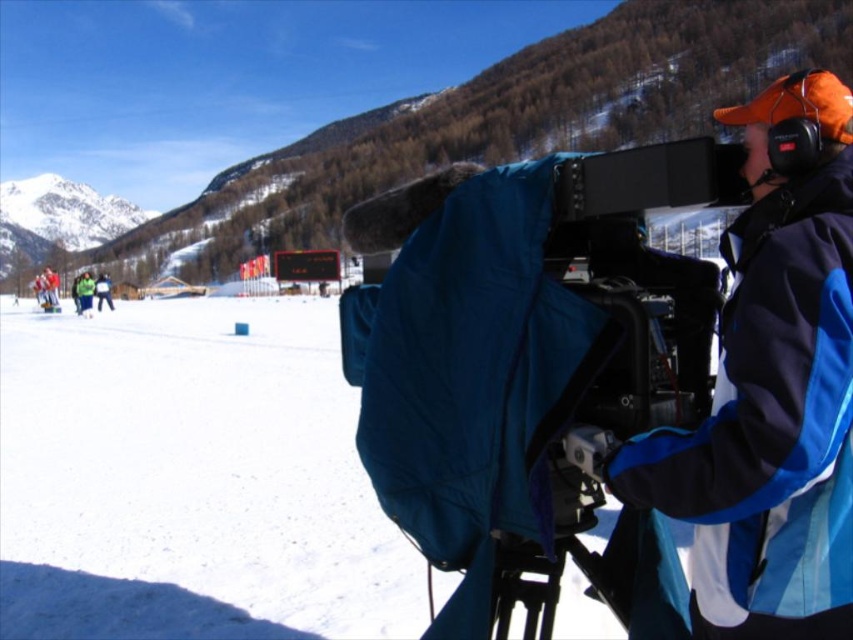
Question: Estimate the real-world distances between objects in this image. Which object is closer to the blue softshell jacket at right?

Choices:
 (A) white snow at upper left
 (B) green reflective jacket at lower left
 (C) blue fabric-covered video camera at right
 (D) green fabric jacket at lower left

Answer: (C)

Question: Does blue softshell jacket at right have a lesser width compared to white snow at upper left?

Choices:
 (A) yes
 (B) no

Answer: (A)

Question: Is blue softshell jacket at right above white snow at upper left?

Choices:
 (A) no
 (B) yes

Answer: (A)

Question: Is blue softshell jacket at right smaller than white snow at upper left?

Choices:
 (A) no
 (B) yes

Answer: (B)

Question: Which object appears farthest from the camera in this image?

Choices:
 (A) blue fabric-covered video camera at right
 (B) green reflective jacket at lower left
 (C) blue softshell jacket at right

Answer: (B)

Question: Estimate the real-world distances between objects in this image. Which object is closer to the green fabric jacket at lower left?

Choices:
 (A) green reflective jacket at lower left
 (B) blue fabric-covered video camera at right

Answer: (A)